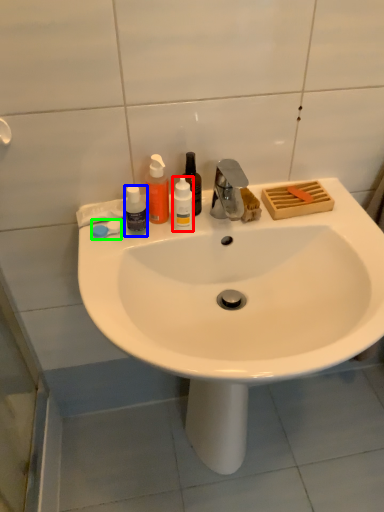
Question: Considering the real-world distances, which object is closest to bottle (highlighted by a red box)? bottle (highlighted by a blue box) or soap (highlighted by a green box).

Choices:
 (A) bottle
 (B) soap

Answer: (A)